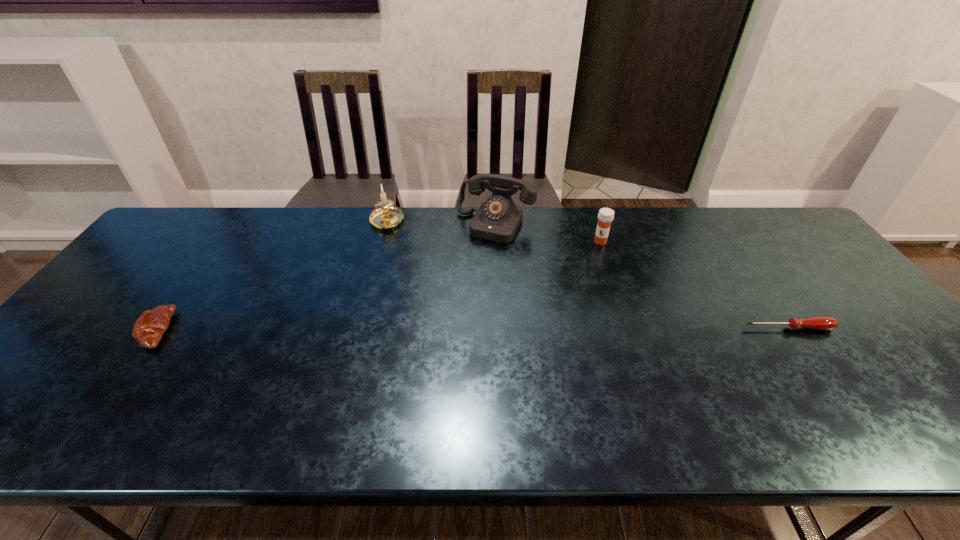
Image resolution: width=960 pixels, height=540 pixels. I want to click on vacant space on the desktop that is between the leftmost object and the screwdriver and is positioned on the dial of the third object from right to left, so click(437, 329).

You are a GUI agent. You are given a task and a screenshot of the screen. Output one action in this format:
    pyautogui.click(x=<x>, y=<y>)
    Task: Click on the free space on the desktop that is between the leftmost object and the shortest object and is positioned on the handle side of the fourth object from right to left
    The height and width of the screenshot is (540, 960).
    Given the screenshot: What is the action you would take?
    pyautogui.click(x=380, y=329)

Identify the location of free spot on the desktop that is between the crescent roll and the rightmost object and is positioned on the label side of the medicine. (541, 329).